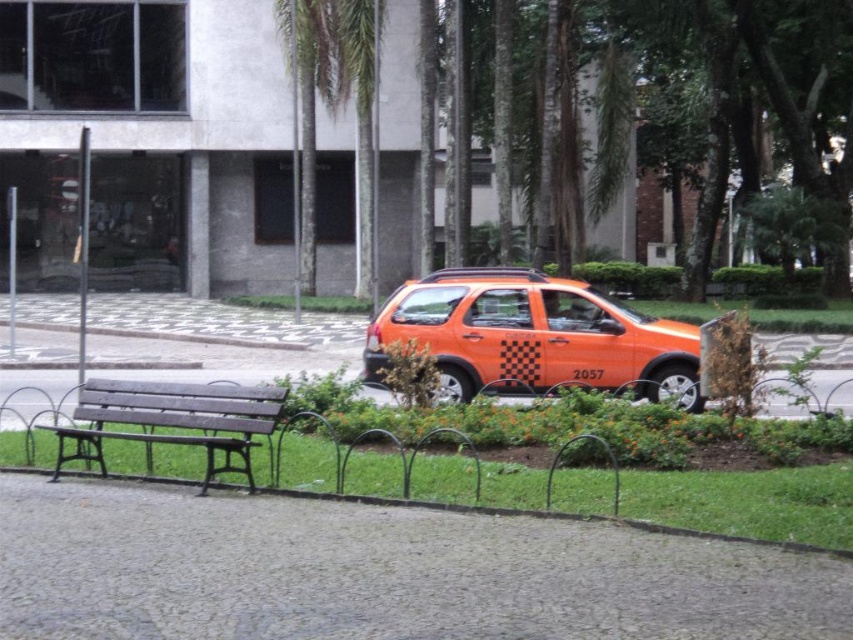
You are standing at the entrance of the building in the background. You want to walk to the orange matte car at center. Which direction should you walk relative to the cobblestone pathway?

The orange matte car at center is positioned at point (x=498, y=452), so you should walk towards the direction of the car along the cobblestone pathway.

You are a delivery person trying to park your 1.8 meters wide van. You see the orange matte car at center and the wooden bench at center in the parking area. Can you fit your van between them without hitting either?

The orange matte car at center might be wider than the wooden bench at center, so it is uncertain if there is enough space. Check the actual width before attempting to park.

You are standing at the point with coordinates point (x=498, y=452) in the image. What object are you standing on?

The point (x=498, y=452) corresponds to the orange matte car at center.